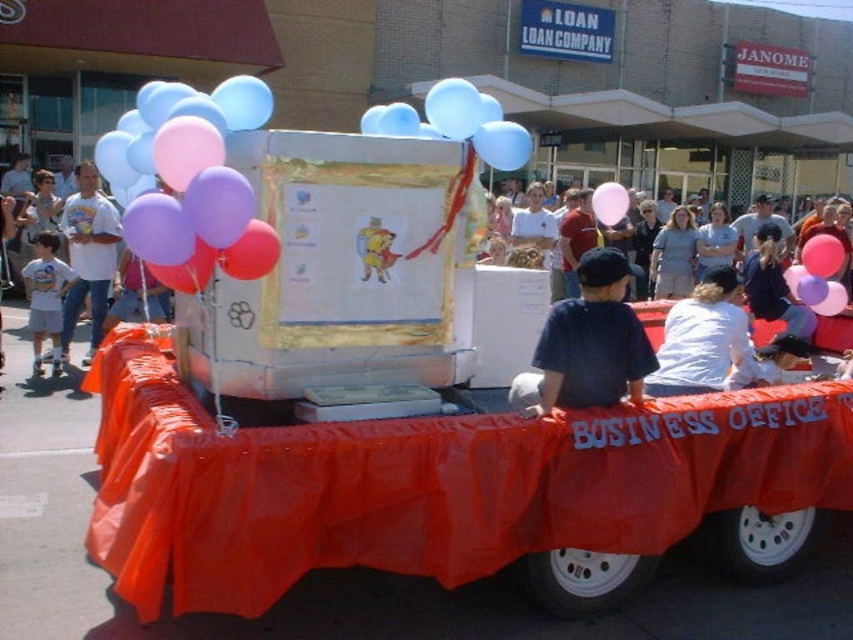
You are a photographer at the event and want to ensure both the dark blue cotton shirt at center and the matte white shirt at center are visible in your photo. Given their height difference, which shirt might you need to adjust your camera angle to capture fully?

The dark blue cotton shirt at center is much taller than the matte white shirt at center, so you might need to adjust your camera angle to capture the full height of the dark blue cotton shirt at center.